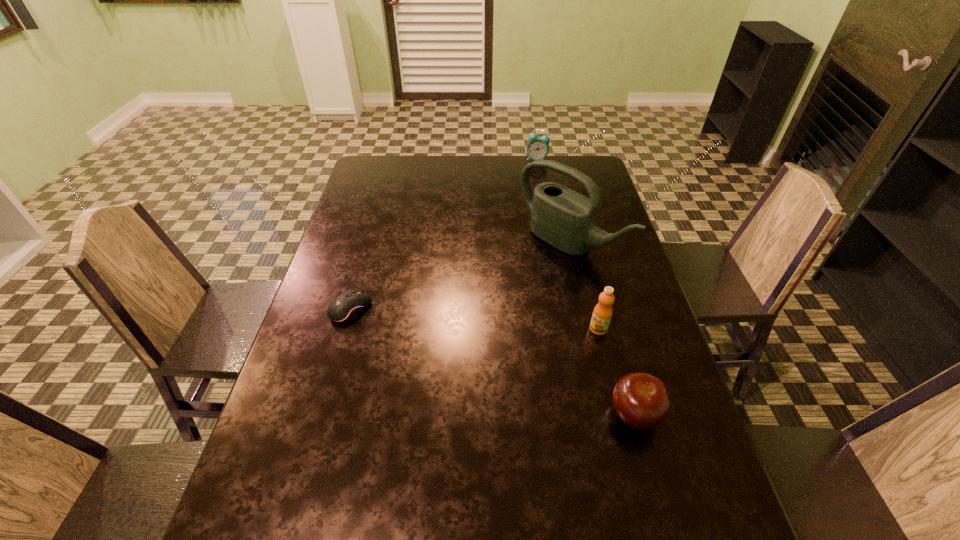
The height and width of the screenshot is (540, 960). In order to click on free location located on the face of the farthest object in this screenshot , I will do `click(533, 178)`.

Where is `free space located on the face of the farthest object`? This screenshot has width=960, height=540. free space located on the face of the farthest object is located at coordinates (523, 221).

Image resolution: width=960 pixels, height=540 pixels. Find the location of `blank space located on the spout of the fourth nearest object`. blank space located on the spout of the fourth nearest object is located at coordinates (440, 340).

Identify the location of vacant space situated on the spout of the fourth nearest object. This screenshot has width=960, height=540. (458, 327).

Locate an element on the screen. This screenshot has height=540, width=960. vacant space located 0.140m on the spout of the fourth nearest object is located at coordinates (505, 292).

Find the location of a particular element. This screenshot has width=960, height=540. vacant space positioned 0.220m on the front label of the orange juice is located at coordinates (518, 367).

This screenshot has height=540, width=960. I want to click on vacant space located on the front label of the orange juice, so click(x=533, y=360).

The height and width of the screenshot is (540, 960). Find the location of `vacant region located 0.090m on the front label of the orange juice`. vacant region located 0.090m on the front label of the orange juice is located at coordinates (563, 346).

The width and height of the screenshot is (960, 540). I want to click on object situated at the far edge, so click(538, 148).

The image size is (960, 540). What are the coordinates of `object situated at the left edge` in the screenshot? It's located at (347, 306).